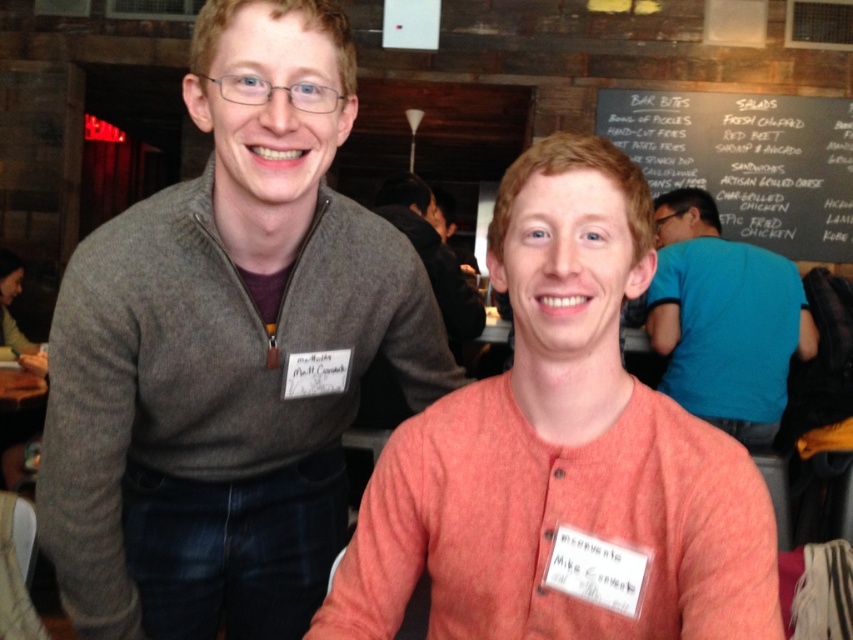
Question: Can you confirm if matte gray sweater at left is smaller than matte gray sweater at center?

Choices:
 (A) no
 (B) yes

Answer: (B)

Question: Which point is closer to the camera?

Choices:
 (A) matte gray sweater at center
 (B) black chalkboard at upper right
 (C) matte orange shirt at center
 (D) blue cotton shirt at right

Answer: (C)

Question: Which point appears closest to the camera in this image?

Choices:
 (A) (827, 125)
 (B) (419, 252)
 (C) (372, 280)
 (D) (372, 528)

Answer: (D)

Question: In this image, where is matte gray sweater at left located relative to matte gray sweater at center?

Choices:
 (A) left
 (B) right

Answer: (A)

Question: Is matte orange shirt at center to the right of blue cotton shirt at right from the viewer's perspective?

Choices:
 (A) yes
 (B) no

Answer: (B)

Question: Which point is farther to the camera?

Choices:
 (A) matte gray sweater at left
 (B) matte gray sweater at center

Answer: (B)